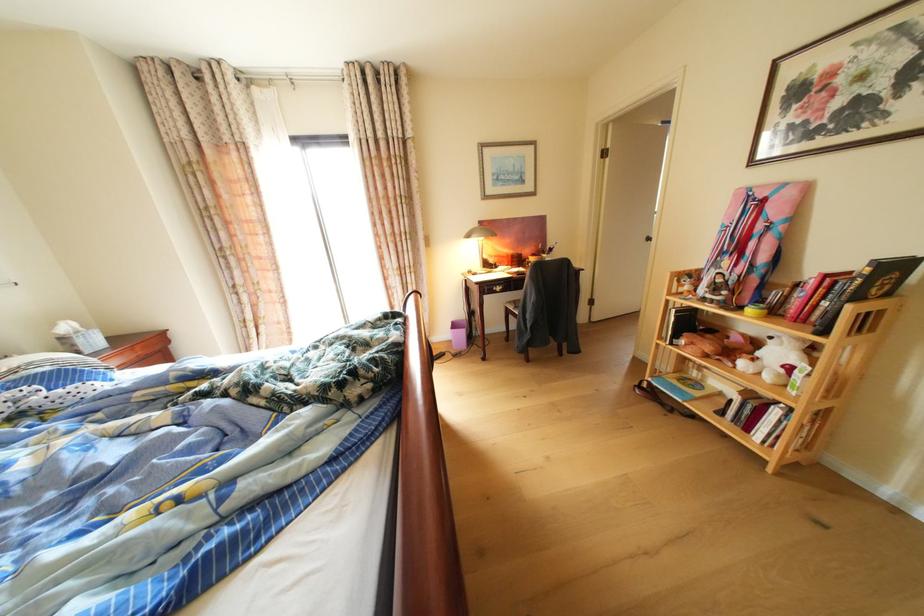
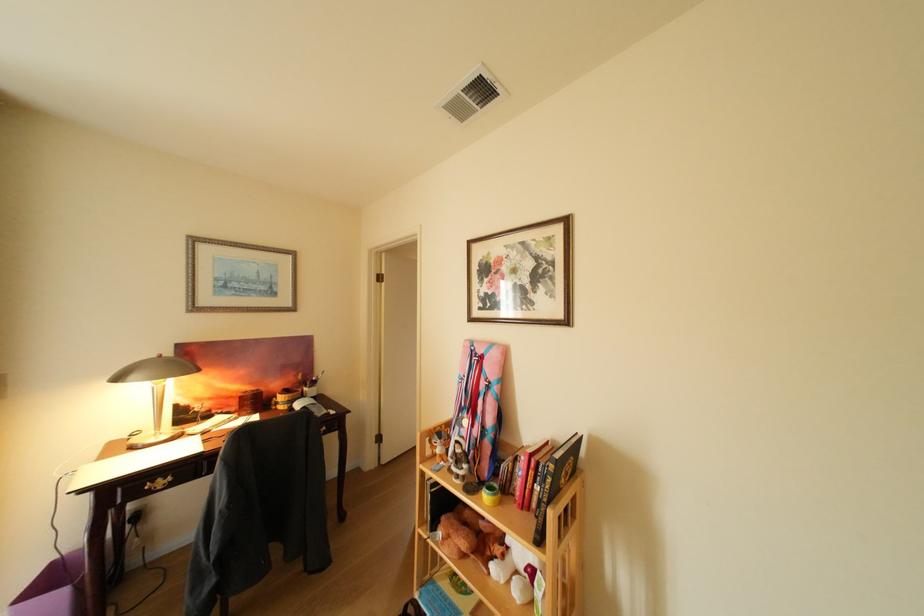
Find the pixel in the second image that matches [800,299] in the first image.

(525, 475)